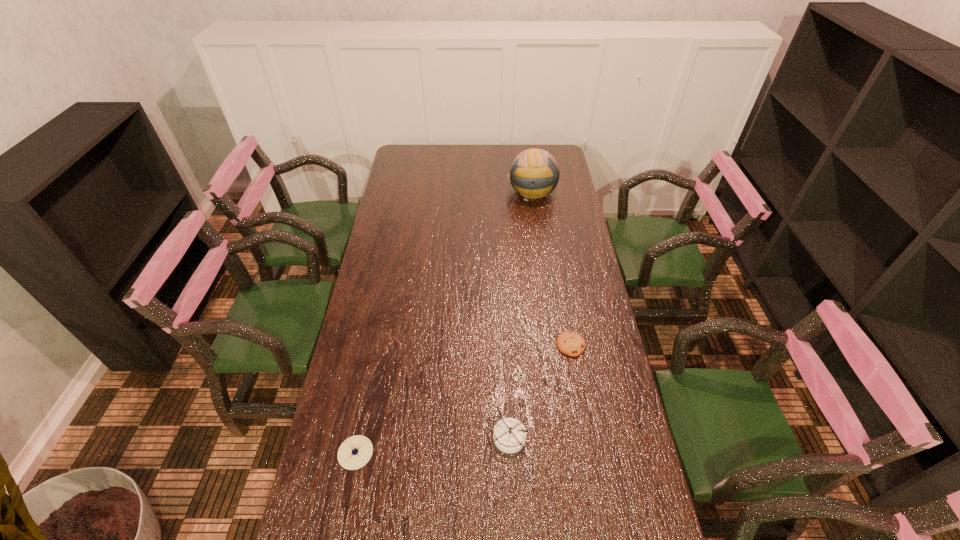
You are a GUI agent. You are given a task and a screenshot of the screen. Output one action in this format:
    pyautogui.click(x=<x>, y=<y>)
    Task: Click on the volleyball
    The height and width of the screenshot is (540, 960).
    Given the screenshot: What is the action you would take?
    pyautogui.click(x=534, y=173)

Locate an element on the screen. the farthest object is located at coordinates (534, 173).

The height and width of the screenshot is (540, 960). Find the location of `the taller compass`. the taller compass is located at coordinates (509, 435).

You are a GUI agent. You are given a task and a screenshot of the screen. Output one action in this format:
    pyautogui.click(x=<x>, y=<y>)
    Task: Click on the right compass
    The image size is (960, 540).
    Given the screenshot: What is the action you would take?
    pyautogui.click(x=509, y=435)

Where is `the leftmost object`? the leftmost object is located at coordinates (355, 452).

At what (x,y) coordinates should I click in order to perform the action: click on the left compass. Please return your answer as a coordinate pair (x, y). The height and width of the screenshot is (540, 960). Looking at the image, I should click on (355, 452).

Identify the location of the third nearest object. Image resolution: width=960 pixels, height=540 pixels. (570, 343).

Where is `the shortest object`? This screenshot has width=960, height=540. the shortest object is located at coordinates pos(570,343).

Where is `free location located on the left of the volleyball`? free location located on the left of the volleyball is located at coordinates tap(473, 192).

The height and width of the screenshot is (540, 960). In order to click on vacant space located on the left of the taller compass in this screenshot , I will do (429, 437).